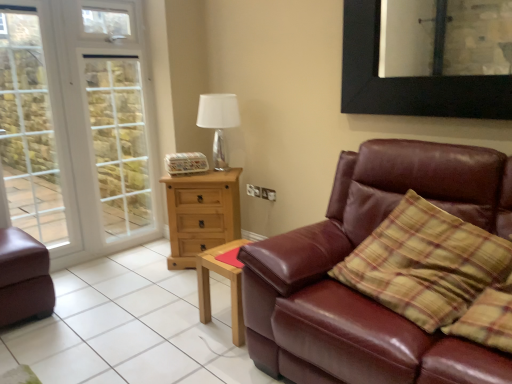
Identify the location of vacant area that lies to the right of matte brown leather couch at lower left, the second studio couch from the right. (84, 304).